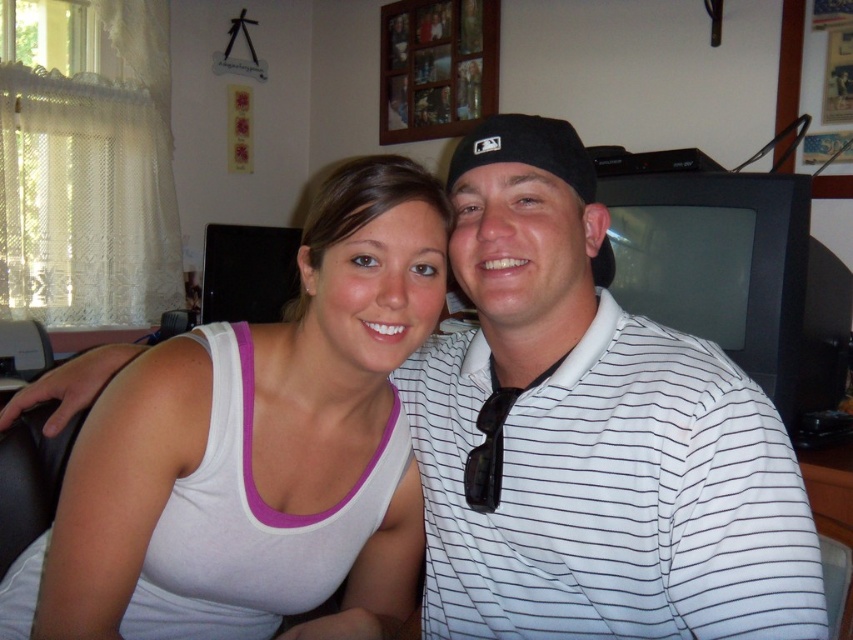
Can you confirm if white striped polo shirt at right is positioned to the right of white tank top at center?

Correct, you'll find white striped polo shirt at right to the right of white tank top at center.

Is white striped polo shirt at right bigger than white tank top at center?

No, white striped polo shirt at right is not bigger than white tank top at center.

Does point (558, 532) come behind point (119, 420)?

No, (558, 532) is closer to viewer.

Where is `white striped polo shirt at right`? The image size is (853, 640). white striped polo shirt at right is located at coordinates (612, 496).